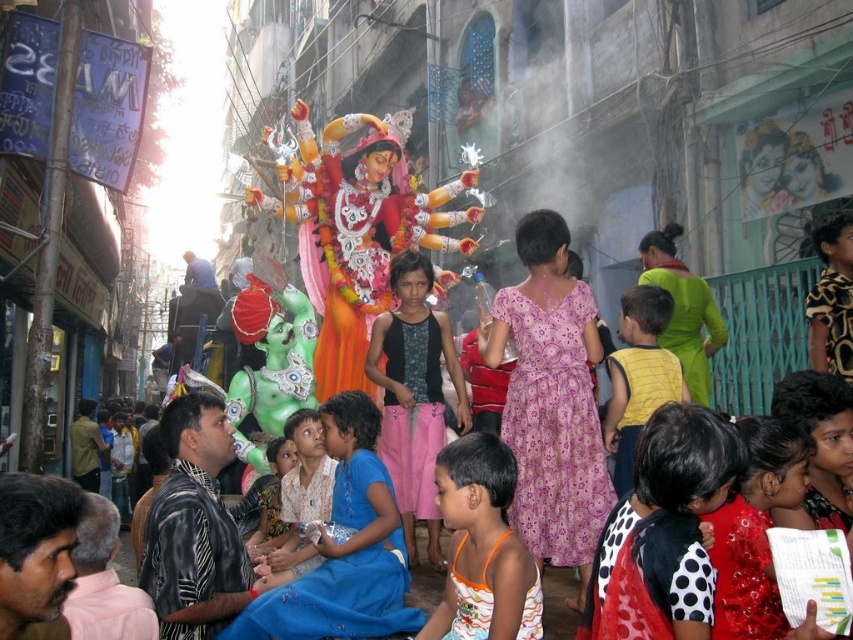
Who is positioned more to the left, red satin dress at center or blue fabric dress at center?

Positioned to the left is blue fabric dress at center.

Is red satin dress at center to the left of blue fabric dress at center from the viewer's perspective?

In fact, red satin dress at center is to the right of blue fabric dress at center.

Which is behind, point (753, 417) or point (280, 449)?

Positioned behind is point (280, 449).

The height and width of the screenshot is (640, 853). Find the location of `red satin dress at center`. red satin dress at center is located at coordinates pyautogui.click(x=755, y=529).

You are a GUI agent. You are given a task and a screenshot of the screen. Output one action in this format:
    pyautogui.click(x=<x>, y=<y>)
    Task: Click on the orange printed tank top at center
    The height and width of the screenshot is (640, 853).
    Given the screenshot: What is the action you would take?
    pyautogui.click(x=482, y=547)

Which of these two, orange printed tank top at center or red satin dress at center, stands shorter?

Standing shorter between the two is red satin dress at center.

The width and height of the screenshot is (853, 640). I want to click on orange printed tank top at center, so click(x=482, y=547).

Who is shorter, yellow cotton shirt at center or blue fabric dress at center?

blue fabric dress at center

Between point (637, 339) and point (293, 454), which one is positioned behind?

Point (293, 454)

At what (x,y) coordinates should I click in order to perform the action: click on yellow cotton shirt at center. Please return your answer as a coordinate pair (x, y). This screenshot has height=640, width=853. Looking at the image, I should click on (637, 376).